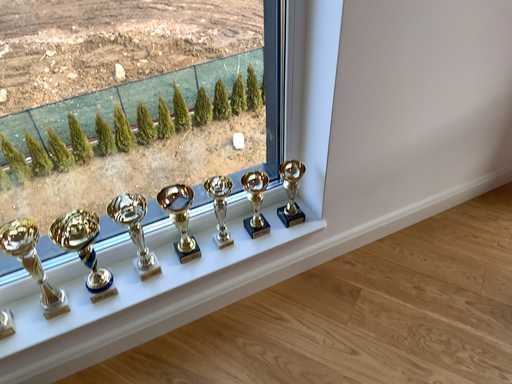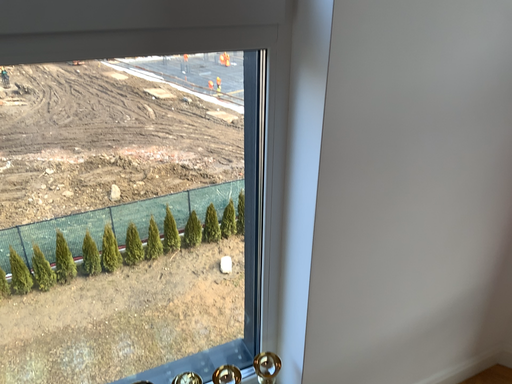
Question: Which way did the camera rotate in the video?

Choices:
 (A) rotated upward
 (B) rotated downward

Answer: (A)